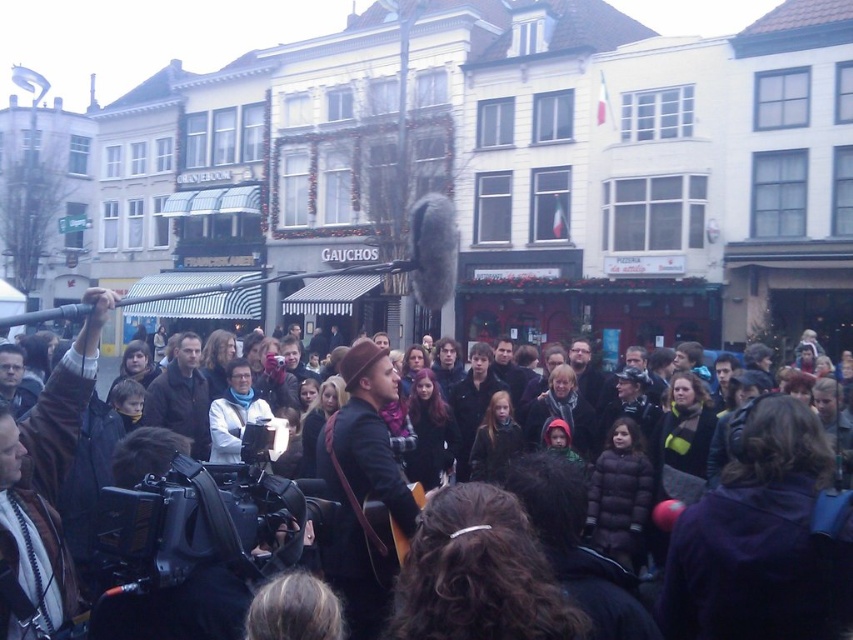
Question: Which point appears farthest from the camera in this image?

Choices:
 (A) (132, 584)
 (B) (811, 413)

Answer: (B)

Question: Which object appears closest to the camera in this image?

Choices:
 (A) black plastic video camera at center
 (B) dark brown leather jacket at center

Answer: (B)

Question: Which point is farther to the camera?

Choices:
 (A) (172, 432)
 (B) (833, 464)

Answer: (A)

Question: Does black plastic video camera at center have a larger size compared to dark brown leather jacket at center?

Choices:
 (A) no
 (B) yes

Answer: (A)

Question: Does black plastic video camera at center lie behind dark brown leather jacket at center?

Choices:
 (A) no
 (B) yes

Answer: (B)

Question: Is black plastic video camera at center in front of dark brown leather jacket at center?

Choices:
 (A) no
 (B) yes

Answer: (A)